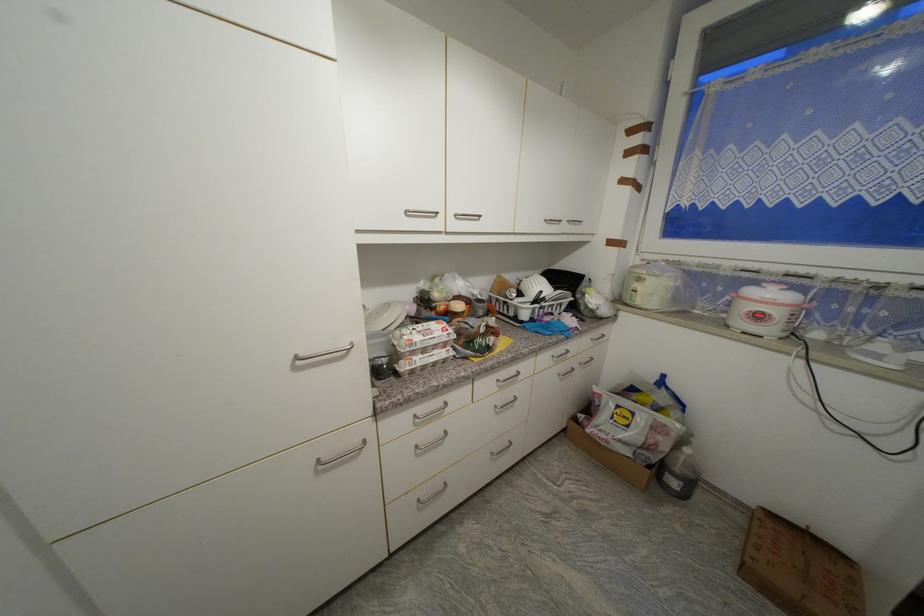
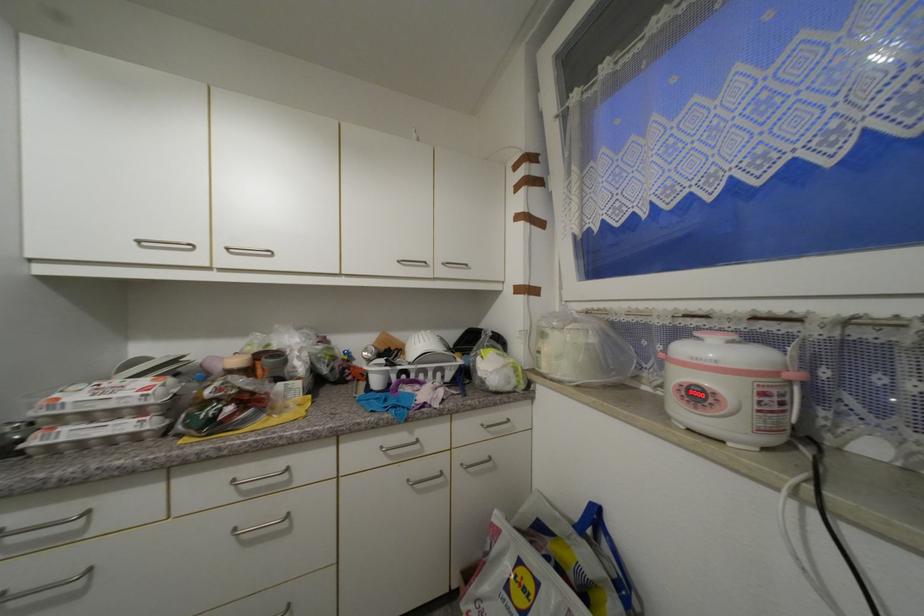
Where in the second image is the point corresponding to point (421, 448) from the first image?

(6, 597)